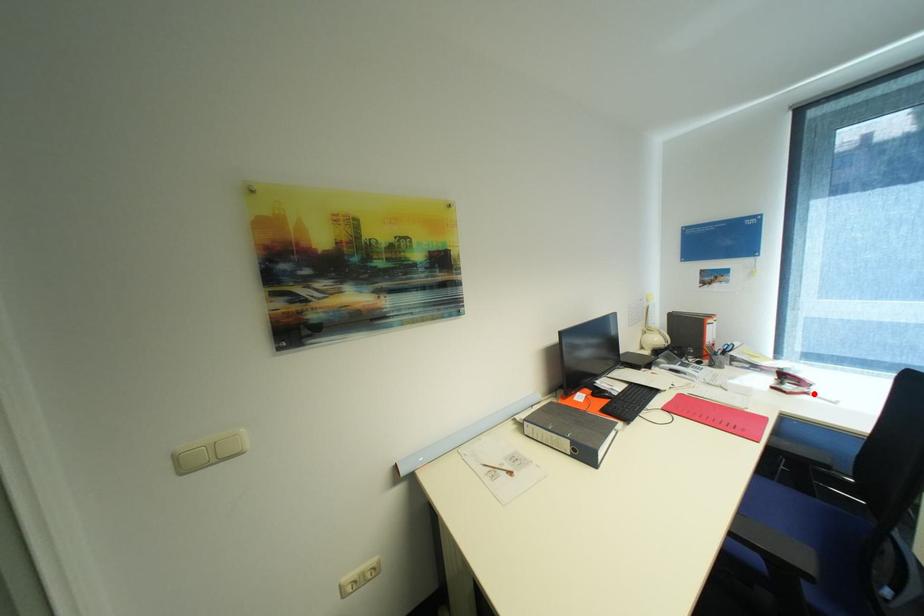
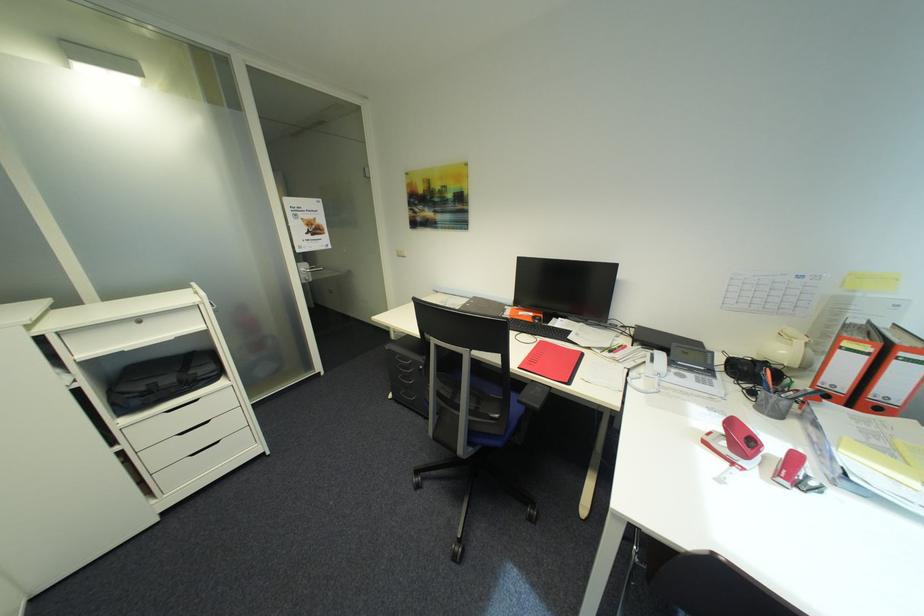
Locate, in the second image, the point that corresponds to the highlighted location in the first image.

(742, 464)